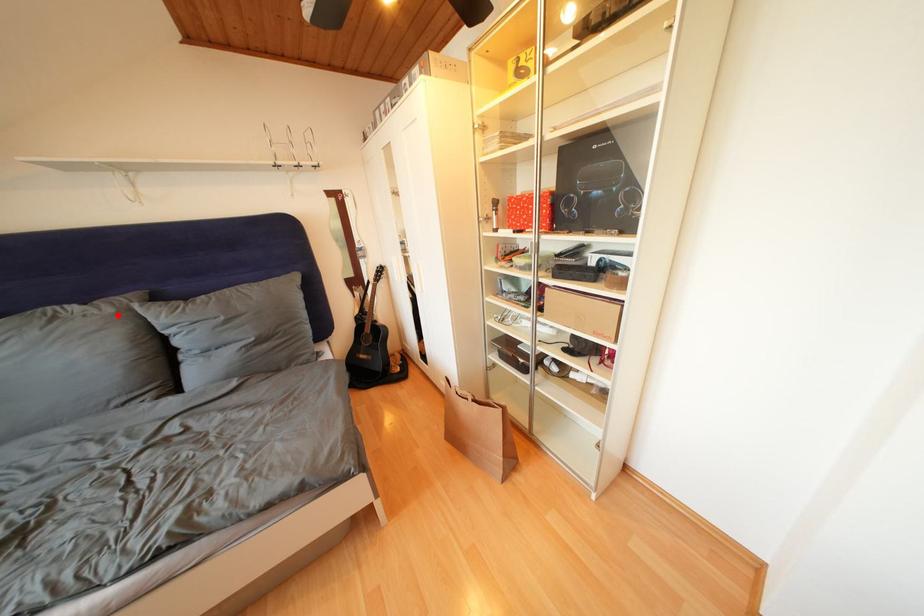
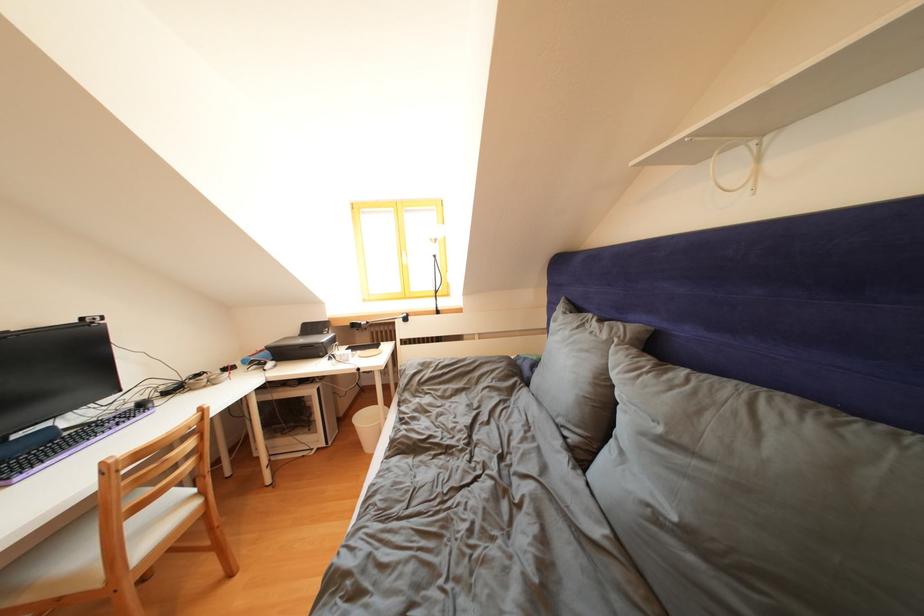
Where in the second image is the point corresponding to the highlighted location from the first image?

(612, 341)